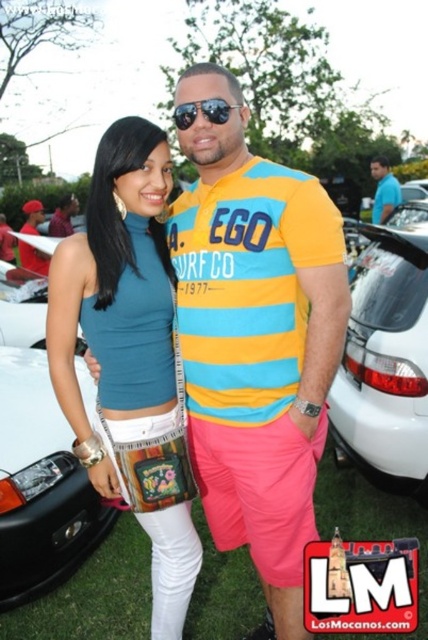
Does white matte car at right have a lesser height compared to sunglasses at center?

No.

Which is behind, point (409, 339) or point (201, 106)?

The point (409, 339) is behind.

The height and width of the screenshot is (640, 428). In order to click on white matte car at right in this screenshot , I will do `click(386, 364)`.

Based on the photo, can you confirm if teal matte tank top at center is thinner than sunglasses at center?

No.

Which is more to the left, teal matte tank top at center or sunglasses at center?

From the viewer's perspective, teal matte tank top at center appears more on the left side.

I want to click on teal matte tank top at center, so click(130, 356).

Locate an element on the screen. This screenshot has height=640, width=428. teal matte tank top at center is located at coordinates (130, 356).

Who is higher up, white matte car at lower left or blue cotton shirt at upper right?

blue cotton shirt at upper right

Consider the image. Is the position of white matte car at lower left less distant than that of blue cotton shirt at upper right?

That is True.

This screenshot has width=428, height=640. Identify the location of white matte car at lower left. (39, 484).